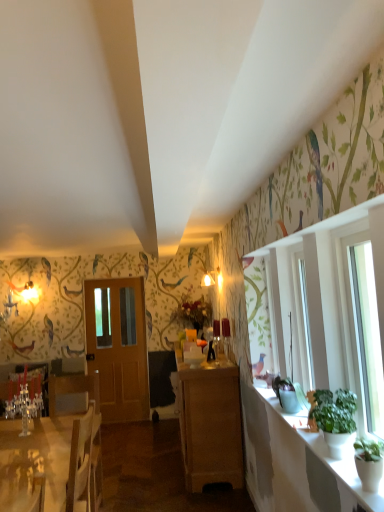
Describe the element at coordinates (335, 419) in the screenshot. I see `green leafy plant at right` at that location.

Image resolution: width=384 pixels, height=512 pixels. Describe the element at coordinates (36, 388) in the screenshot. I see `wooden armchair at left` at that location.

What do you see at coordinates (299, 465) in the screenshot? This screenshot has width=384, height=512. I see `white glossy counter top at right` at bounding box center [299, 465].

You are a GUI agent. You are given a task and a screenshot of the screen. Output one action in this format:
    pyautogui.click(x=<x>, y=<y>)
    Task: Click on the green leafy plant at right
    Image resolution: width=384 pixels, height=512 pixels.
    Given the screenshot: What is the action you would take?
    (335, 419)

Does white glossy desk at lower left appear on the right side of green leafy plant at right?

No.

Is the surface of white glossy desk at lower left in direct contact with green leafy plant at right?

No, white glossy desk at lower left is not touching green leafy plant at right.

Between white glossy desk at lower left and green leafy plant at right, which one has less height?

Standing shorter between the two is green leafy plant at right.

Based on the photo, which of these two, light brown wooden door at center or wooden armchair at left, is bigger?

With larger size is light brown wooden door at center.

Is the position of light brown wooden door at center less distant than that of wooden armchair at left?

No, light brown wooden door at center is further to the viewer.

Between light brown wooden door at center and wooden armchair at left, which one has smaller width?

Thinner between the two is light brown wooden door at center.

Does point (227, 374) come behind point (378, 407)?

Yes, it is behind point (378, 407).

Considering the positions of objects wooden cabinet at center and green matte plant at right in the image provided, who is more to the left, wooden cabinet at center or green matte plant at right?

Positioned to the left is wooden cabinet at center.

From the image's perspective, is wooden cabinet at center located above or below green matte plant at right?

wooden cabinet at center is situated lower than green matte plant at right in the image.

Based on their sizes in the image, would you say wooden armchair at left is bigger or smaller than white glossy counter top at right?

Clearly, wooden armchair at left is larger in size than white glossy counter top at right.

Considering the relative positions of wooden armchair at left and white glossy counter top at right in the image provided, is wooden armchair at left behind white glossy counter top at right?

Yes, the depth of wooden armchair at left is greater than that of white glossy counter top at right.

Considering the relative sizes of wooden armchair at left and white glossy counter top at right in the image provided, is wooden armchair at left shorter than white glossy counter top at right?

No, wooden armchair at left is not shorter than white glossy counter top at right.

Where is `desk that is on the left side of green matte plant at right`? desk that is on the left side of green matte plant at right is located at coordinates (34, 462).

From the picture: Between white glossy desk at lower left and green matte plant at right, which one has smaller size?

With smaller size is green matte plant at right.

In the image, is white glossy desk at lower left positioned in front of or behind green matte plant at right?

Clearly, white glossy desk at lower left is behind green matte plant at right.

From the image's perspective, which one is positioned lower, white glossy desk at lower left or wooden cabinet at center?

white glossy desk at lower left.

Considering the relative sizes of white glossy desk at lower left and wooden cabinet at center in the image provided, is white glossy desk at lower left wider than wooden cabinet at center?

Yes, white glossy desk at lower left is wider than wooden cabinet at center.

From a real-world perspective, who is located lower, white glossy desk at lower left or wooden cabinet at center?

white glossy desk at lower left.

At what (x,y) coordinates should I click in order to perform the action: click on cabinetry that appears behind the white glossy desk at lower left. Please return your answer as a coordinate pair (x, y). The width and height of the screenshot is (384, 512). Looking at the image, I should click on (210, 422).

How many degrees apart are the facing directions of white glossy counter top at right and wooden armchair at left?

The facing directions of white glossy counter top at right and wooden armchair at left are 89.3 degrees apart.

In terms of height, does white glossy counter top at right look taller or shorter compared to wooden armchair at left?

white glossy counter top at right is shorter than wooden armchair at left.

Is wooden armchair at left at the back of white glossy counter top at right?

That's not correct — white glossy counter top at right is not looking away from wooden armchair at left.

Is wooden armchair at left located within white glossy counter top at right?

Definitely not — wooden armchair at left is not inside white glossy counter top at right.

Find the location of a particular element. desk below the green leafy plant at right (from a real-world perspective) is located at coordinates (34, 462).

Locate an element on the screen. armchair lying on the left of light brown wooden door at center is located at coordinates (36, 388).

Considering their positions, is light brown wooden door at center positioned closer to green matte plant at right than wooden armchair at left?

wooden armchair at left.

From the image, which object appears to be nearer to wooden cabinet at center, white glossy counter top at right or light brown wooden door at center?

The object closer to wooden cabinet at center is white glossy counter top at right.

Looking at the image, which one is located further to green leafy plant at right, white glossy desk at lower left or green matte plant at right?

The object further to green leafy plant at right is white glossy desk at lower left.

Based on their spatial positions, is wooden cabinet at center or white glossy counter top at right further from white glossy desk at lower left?

white glossy counter top at right lies further to white glossy desk at lower left than the other object.

From the image, which object appears to be farther from light brown wooden door at center, white glossy counter top at right or wooden armchair at left?

white glossy counter top at right lies further to light brown wooden door at center than the other object.

Which object lies further to the anchor point wooden cabinet at center, white glossy desk at lower left or green matte plant at right?

green matte plant at right.

In the scene shown: Which object lies nearer to the anchor point light brown wooden door at center, white glossy desk at lower left or green matte plant at right?

white glossy desk at lower left lies closer to light brown wooden door at center than the other object.

Which object lies nearer to the anchor point white glossy desk at lower left, light brown wooden door at center or green leafy plant at right?

green leafy plant at right.

This screenshot has width=384, height=512. Find the location of `desk between white glossy counter top at right and light brown wooden door at center along the z-axis`. desk between white glossy counter top at right and light brown wooden door at center along the z-axis is located at coordinates (34, 462).

This screenshot has width=384, height=512. In order to click on houseplant between white glossy counter top at right and light brown wooden door at center along the z-axis in this screenshot , I will do `click(335, 419)`.

Find the location of `desk between green matte plant at right and wooden cabinet at center in the front-back direction`. desk between green matte plant at right and wooden cabinet at center in the front-back direction is located at coordinates (34, 462).

You are a GUI agent. You are given a task and a screenshot of the screen. Output one action in this format:
    pyautogui.click(x=<x>, y=<y>)
    Task: Click on the desk between green leafy plant at right and light brown wooden door at center in the front-back direction
    The height and width of the screenshot is (512, 384).
    Given the screenshot: What is the action you would take?
    pyautogui.click(x=34, y=462)